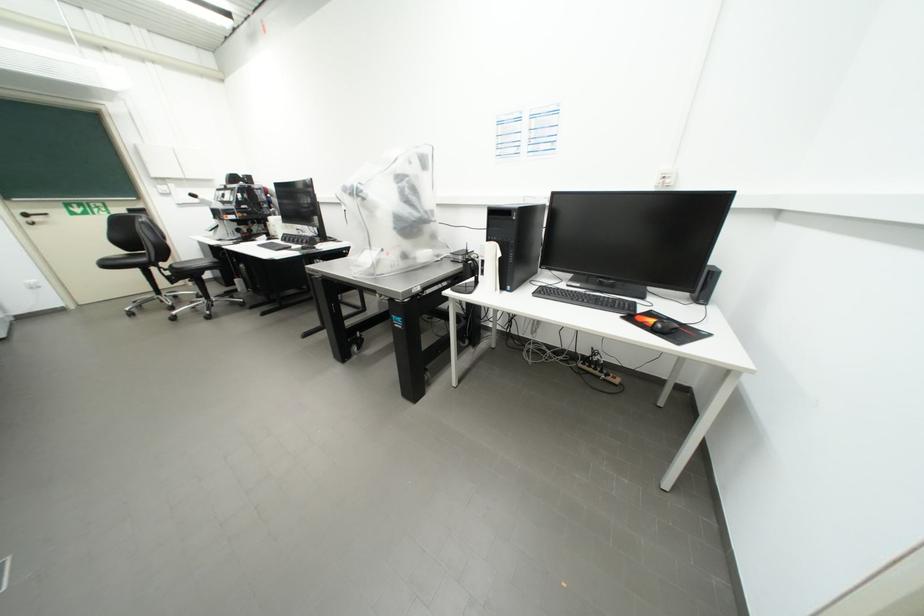
Find where to lift the small black speaker. Please return your answer as a coordinate pair (x, y).

(712, 276)